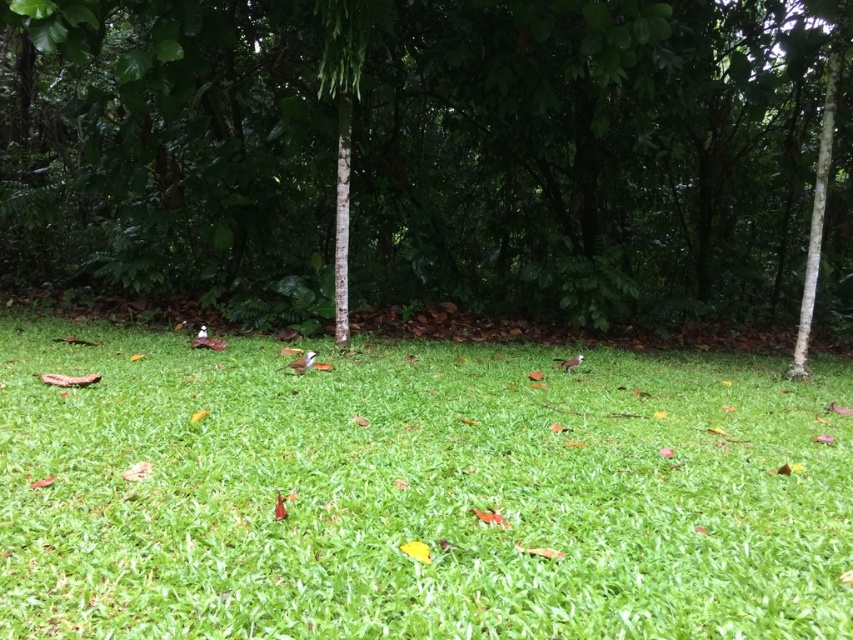
Question: Can you confirm if green leafy tree at center is bigger than green grass at center?

Choices:
 (A) no
 (B) yes

Answer: (B)

Question: Which point appears farthest from the camera in this image?

Choices:
 (A) (3, 20)
 (B) (611, 412)

Answer: (A)

Question: Is green leafy tree at center further to camera compared to green grass at center?

Choices:
 (A) yes
 (B) no

Answer: (A)

Question: Can you confirm if green leafy tree at center is smaller than green grass at center?

Choices:
 (A) yes
 (B) no

Answer: (B)

Question: Which point is closer to the camera?

Choices:
 (A) (781, 426)
 (B) (842, 164)

Answer: (A)

Question: Which of the following is the closest to the observer?

Choices:
 (A) green grass at center
 (B) green leafy tree at center

Answer: (A)